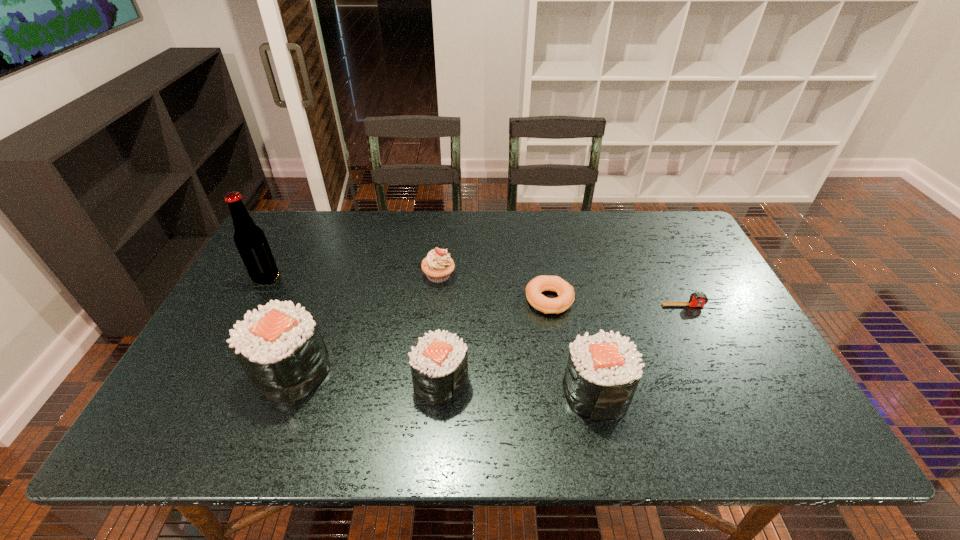
At what (x,y) coordinates should I click in order to perform the action: click on free space located 0.250m on the back of the second sushi from right to left. Please return your answer as a coordinate pair (x, y). Image resolution: width=960 pixels, height=540 pixels. Looking at the image, I should click on (448, 289).

Where is `free point located on the left of the third tallest object`? free point located on the left of the third tallest object is located at coordinates (498, 392).

What are the coordinates of `vacant region located on the left of the cupcake` in the screenshot? It's located at click(351, 276).

Identify the location of vacant space situated 0.310m on the right of the leftmost object. Image resolution: width=960 pixels, height=540 pixels. (385, 278).

Where is `free space located 0.390m on the left of the tape measure`? free space located 0.390m on the left of the tape measure is located at coordinates (521, 306).

Find the location of a particular element. Image resolution: width=960 pixels, height=540 pixels. blank space located on the back of the bagel is located at coordinates (540, 244).

Where is `sushi positioned at the left edge`? sushi positioned at the left edge is located at coordinates (280, 348).

At what (x,y) coordinates should I click in order to perform the action: click on beer bottle that is positioned at the left edge. Please return your answer as a coordinate pair (x, y). Image resolution: width=960 pixels, height=540 pixels. Looking at the image, I should click on (250, 240).

The width and height of the screenshot is (960, 540). I want to click on object positioned at the right edge, so click(x=697, y=299).

I want to click on object located in the near left corner section of the desktop, so click(x=280, y=348).